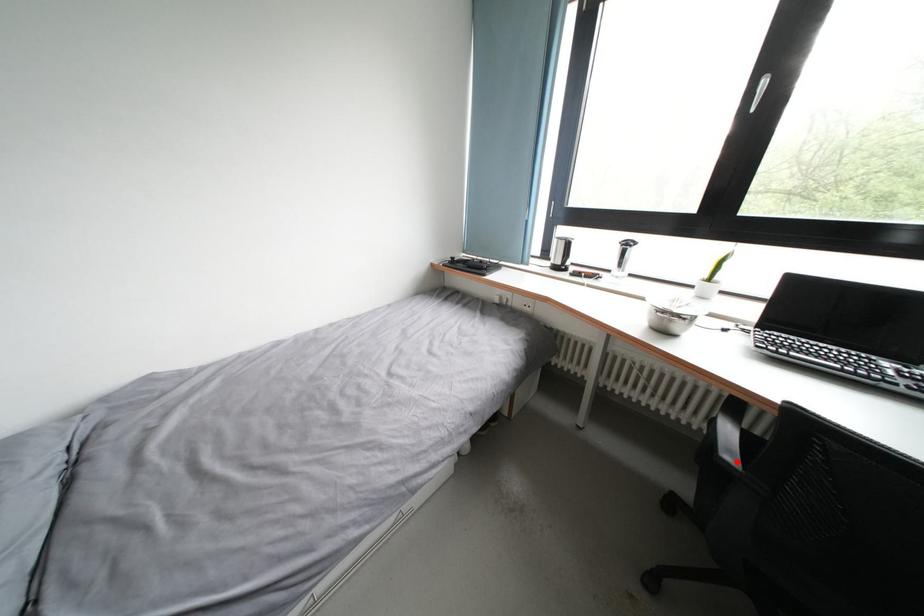
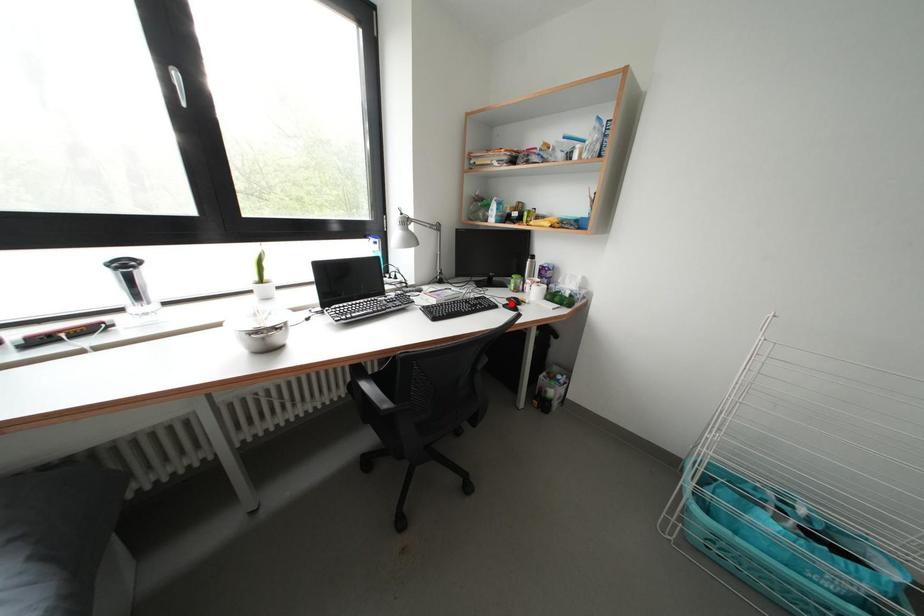
I am providing you with two images of the same scene from different viewpoints. A red point is marked on the first image and another point is marked on the second image. Does the point marked in image1 correspond to the same location as the one in image2?

No